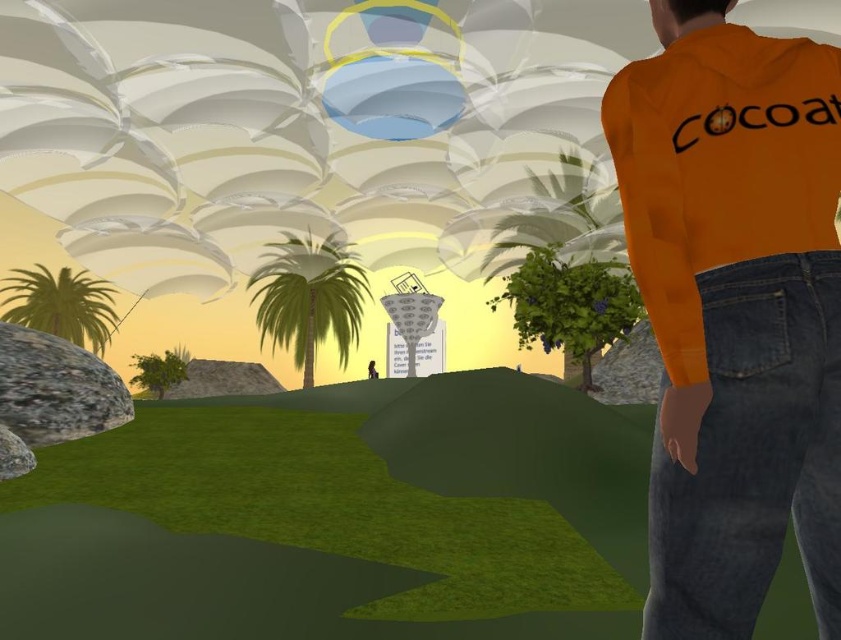
What is the color of the grass where the point at coordinates (337, 516) is located?

The grass at the point (337, 516) is green.

You are standing at the camera position and want to reach the point marked at coordinates [752,189]. Can you walk directly to it without moving around any obstacles?

Yes, you can walk directly to the point marked at coordinates [752,189] because there are no obstacles mentioned between the camera and the point.

You are standing at the position of the person in the scene. Looking down, you see the green grass at lower left and the denim at right. Which one is closer to your feet?

The denim at right is closer to your feet since it is shorter than the green grass at lower left, which is taller and farther away.